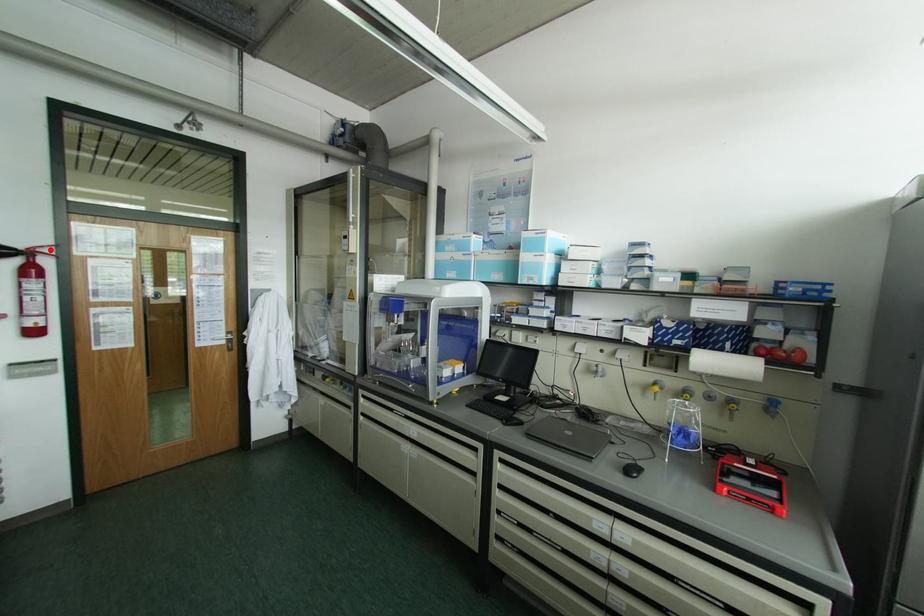
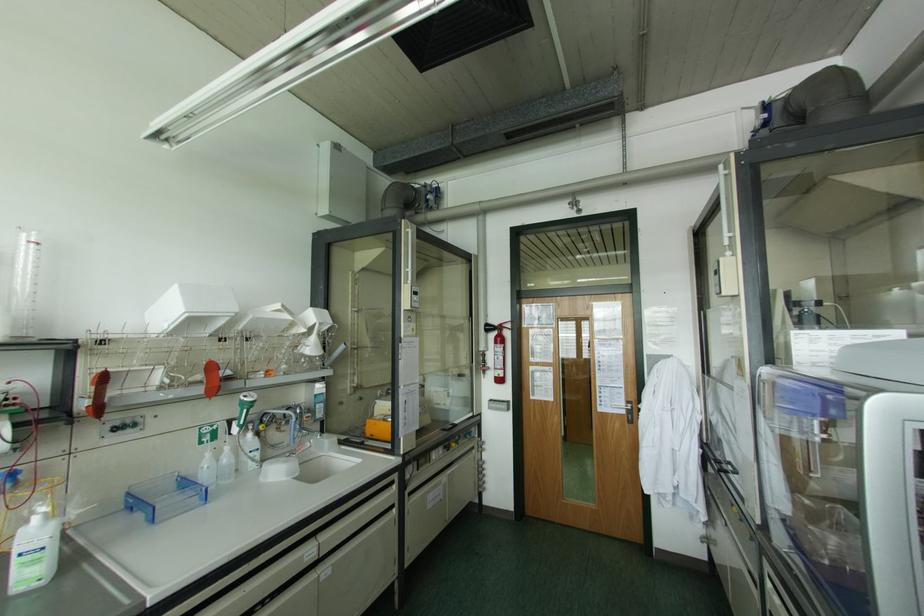
The point at the highlighted location is marked in the first image. Where is the corresponding point in the second image?

(507, 325)